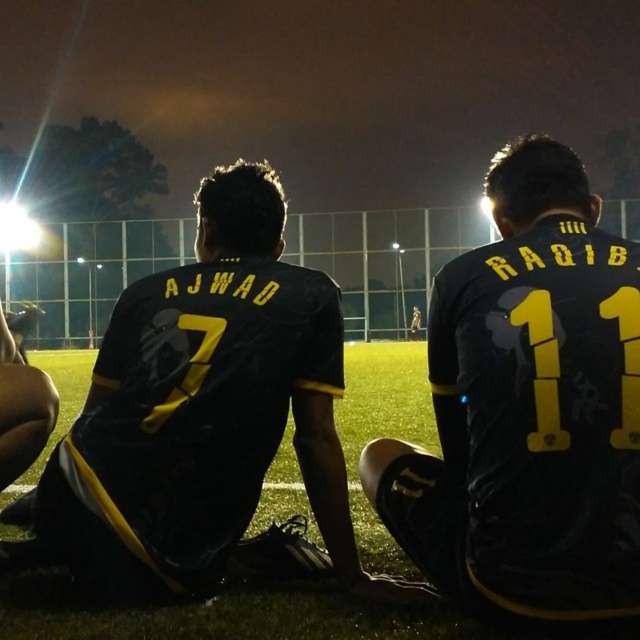
You are a photographer trying to capture a photo of both the black matte jersey at center and the matte black jersey at left. Since you want to ensure both are in focus, you need to know which one is taller. Can you tell me which jersey is taller?

The black matte jersey at center is much taller than the matte black jersey at left.

You are a photographer adjusting your camera settings to focus on two points in the image. The first point is labeled as point (557, 512) and the second is point (339, 392). Which point should you focus on first if you want to ensure the closer one is in sharp focus?

Point (557, 512) is closer to the camera than point (339, 392), so you should focus on point (557, 512) first to ensure it is in sharp focus.

You are a photographer trying to capture both the black matte jersey at center and the matte black jersey at left in a single shot. Based on their positions, which jersey should you focus on first to ensure both are in frame?

The black matte jersey at center is located above the matte black jersey at left, so you should focus on the matte black jersey at left first to ensure both are in frame.